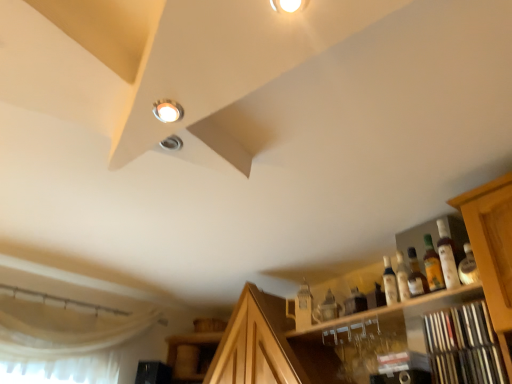
Question: Is matte white droplight at upper left outside of wooden shelf at lower right?

Choices:
 (A) no
 (B) yes

Answer: (B)

Question: Does matte white droplight at upper left lie in front of wooden shelf at lower right?

Choices:
 (A) no
 (B) yes

Answer: (B)

Question: Is matte white droplight at upper left shorter than wooden shelf at lower right?

Choices:
 (A) no
 (B) yes

Answer: (B)

Question: Considering the relative positions of matte white droplight at upper left and wooden shelf at lower right in the image provided, is matte white droplight at upper left behind wooden shelf at lower right?

Choices:
 (A) yes
 (B) no

Answer: (B)

Question: From a real-world perspective, is matte white droplight at upper left positioned over wooden shelf at lower right based on gravity?

Choices:
 (A) yes
 (B) no

Answer: (A)

Question: From a real-world perspective, is matte white droplight at upper left positioned above or below translucent amber bottle at upper right, marked as the 2th bottle in a left-to-right arrangement?

Choices:
 (A) above
 (B) below

Answer: (A)

Question: Is point 165,114 positioned closer to the camera than point 433,258?

Choices:
 (A) closer
 (B) farther

Answer: (A)

Question: In terms of size, does matte white droplight at upper left appear bigger or smaller than translucent amber bottle at upper right, marked as the 2th bottle in a left-to-right arrangement?

Choices:
 (A) small
 (B) big

Answer: (A)

Question: In the image, is matte white droplight at upper left positioned in front of or behind translucent amber bottle at upper right, which is the second bottle in right-to-left order?

Choices:
 (A) front
 (B) behind

Answer: (A)

Question: Is translucent amber bottle at upper right, marked as the 2th bottle in a left-to-right arrangement, in front of or behind matte glass bottle at right, the 1th bottle positioned from the left, in the image?

Choices:
 (A) front
 (B) behind

Answer: (A)

Question: Does point (437, 256) appear closer or farther from the camera than point (388, 299)?

Choices:
 (A) farther
 (B) closer

Answer: (B)

Question: Based on their sizes in the image, would you say translucent amber bottle at upper right, which is the second bottle in right-to-left order, is bigger or smaller than matte glass bottle at right, arranged as the 3th bottle when viewed from the right?

Choices:
 (A) big
 (B) small

Answer: (A)

Question: Is translucent amber bottle at upper right, which is the second bottle in right-to-left order, inside the boundaries of matte glass bottle at right, arranged as the 3th bottle when viewed from the right, or outside?

Choices:
 (A) inside
 (B) outside

Answer: (B)

Question: In terms of height, does translucent glass bottle at right, marked as the 3th bottle in a left-to-right arrangement, look taller or shorter compared to wooden shelf at lower right?

Choices:
 (A) short
 (B) tall

Answer: (A)

Question: Looking at their shapes, would you say translucent glass bottle at right, marked as the 3th bottle in a left-to-right arrangement, is wider or thinner than wooden shelf at lower right?

Choices:
 (A) thin
 (B) wide

Answer: (A)